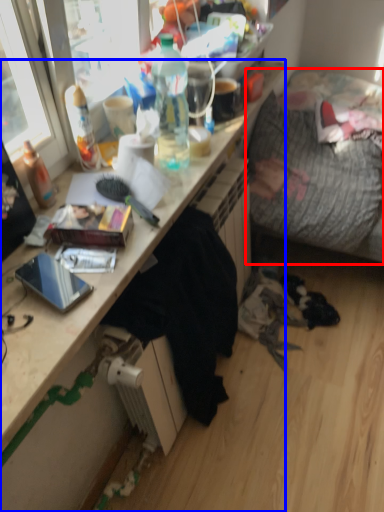
Question: Among these objects, which one is nearest to the camera, studio couch (highlighted by a red box) or desk (highlighted by a blue box)?

Choices:
 (A) studio couch
 (B) desk

Answer: (B)